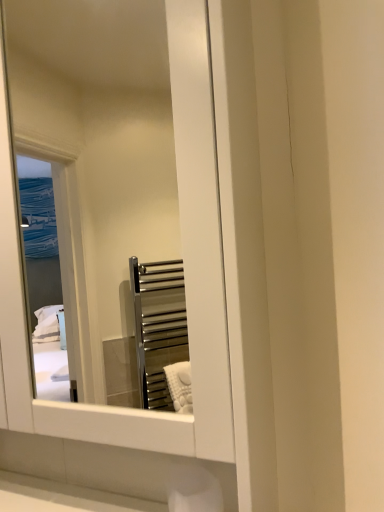
At what (x,y) coordinates should I click in order to perform the action: click on white glossy towel rack at center. Please return your answer as a coordinate pair (x, y). The height and width of the screenshot is (512, 384). Looking at the image, I should click on (120, 213).

The width and height of the screenshot is (384, 512). What do you see at coordinates (120, 213) in the screenshot?
I see `white glossy towel rack at center` at bounding box center [120, 213].

What are the coordinates of `white glossy towel rack at center` in the screenshot? It's located at (120, 213).